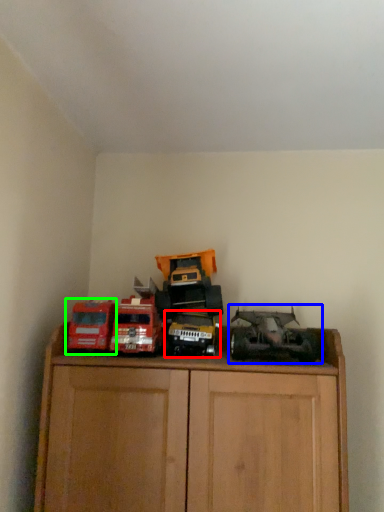
Question: Which is nearer to the toy (highlighted by a red box)? toy (highlighted by a blue box) or toy (highlighted by a green box).

Choices:
 (A) toy
 (B) toy

Answer: (A)